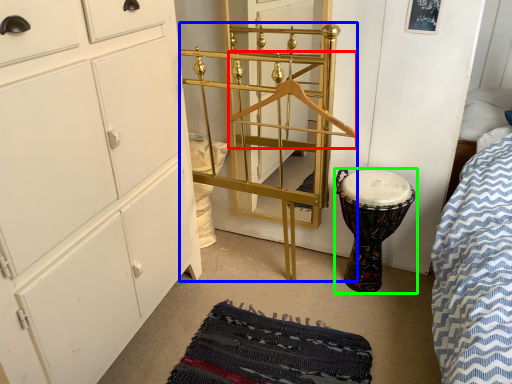
Question: Which object is positioned closest to hanger (highlighted by a red box)? Select from bunk bed (highlighted by a blue box) and drum (highlighted by a green box).

Choices:
 (A) bunk bed
 (B) drum

Answer: (A)